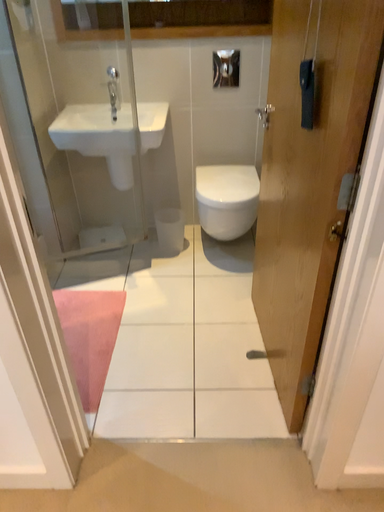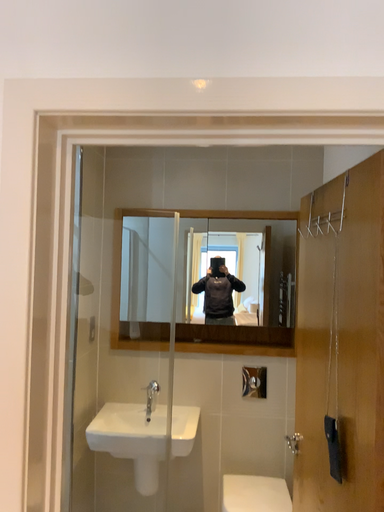
Question: Which way did the camera rotate in the video?

Choices:
 (A) rotated downward
 (B) rotated upward

Answer: (B)